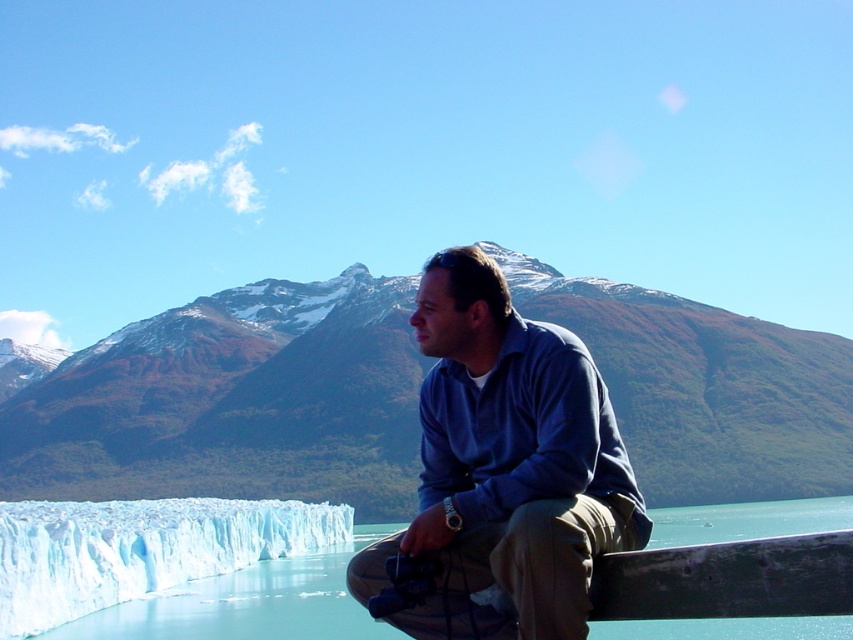
Question: Can you confirm if transparent ice water at lower left is positioned to the right of white ice at lower left?

Choices:
 (A) no
 (B) yes

Answer: (B)

Question: Based on their relative distances, which object is nearer to the transparent ice water at lower left?

Choices:
 (A) white ice at lower left
 (B) blue cotton shirt at center
 (C) snowy rocky mountain at center

Answer: (A)

Question: Is snowy rocky mountain at center thinner than transparent ice water at lower left?

Choices:
 (A) yes
 (B) no

Answer: (B)

Question: Which object is closer to the camera taking this photo?

Choices:
 (A) white ice at lower left
 (B) snowy rocky mountain at center

Answer: (A)

Question: Estimate the real-world distances between objects in this image. Which object is closer to the transparent ice water at lower left?

Choices:
 (A) snowy rocky mountain at center
 (B) white ice at lower left

Answer: (B)

Question: Does snowy rocky mountain at center appear under transparent ice water at lower left?

Choices:
 (A) no
 (B) yes

Answer: (A)